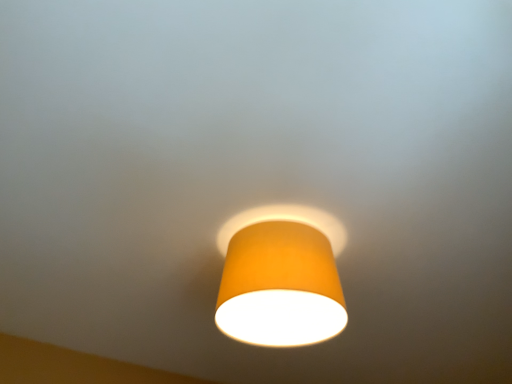
The height and width of the screenshot is (384, 512). What do you see at coordinates (280, 287) in the screenshot?
I see `matte yellow lampshade at center` at bounding box center [280, 287].

The height and width of the screenshot is (384, 512). What are the coordinates of `matte yellow lampshade at center` in the screenshot? It's located at (280, 287).

Identify the location of matte yellow lampshade at center. The image size is (512, 384). (280, 287).